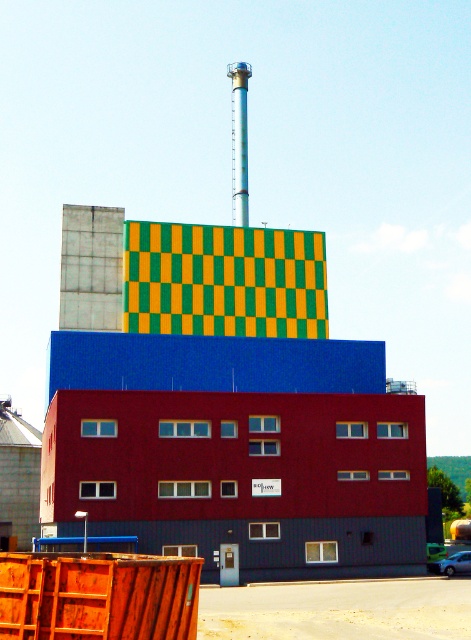
Question: Is matte blue building at center to the left of silver metallic chimney at upper center from the viewer's perspective?

Choices:
 (A) yes
 (B) no

Answer: (A)

Question: Which object is the closest to the smooth concrete chimney at upper center?

Choices:
 (A) matte blue building at center
 (B) silver metallic chimney at upper center
 (C) wooden crate at lower left

Answer: (A)

Question: Considering the real-world distances, which object is closest to the smooth concrete chimney at upper center?

Choices:
 (A) matte blue building at center
 (B) wooden crate at lower left
 (C) silver metallic chimney at upper center

Answer: (A)

Question: Can you confirm if matte blue building at center is positioned above silver metallic chimney at upper center?

Choices:
 (A) yes
 (B) no

Answer: (B)

Question: Estimate the real-world distances between objects in this image. Which object is farther from the matte blue building at center?

Choices:
 (A) wooden crate at lower left
 (B) smooth concrete chimney at upper center
 (C) silver metallic chimney at upper center

Answer: (C)

Question: Is wooden crate at lower left to the right of smooth concrete chimney at upper center from the viewer's perspective?

Choices:
 (A) yes
 (B) no

Answer: (A)